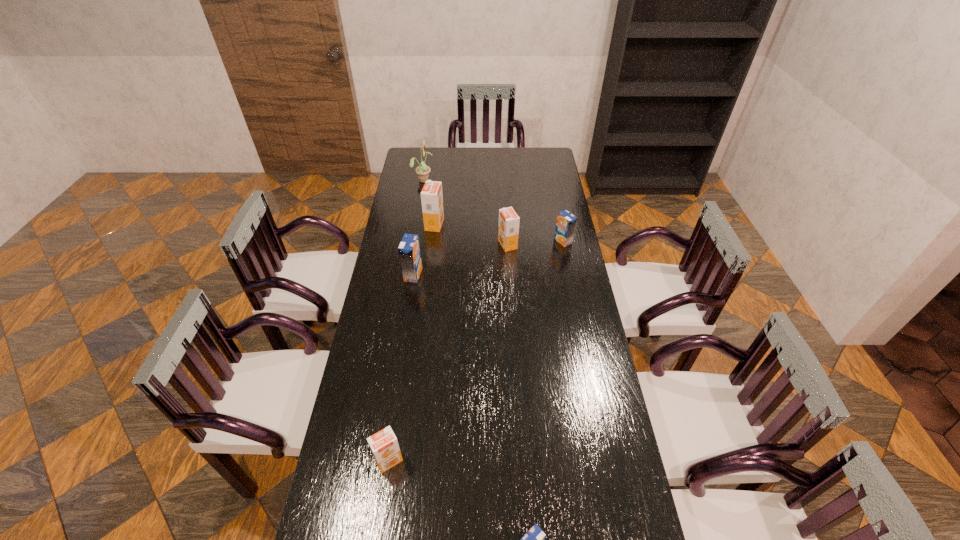
You are a GUI agent. You are given a task and a screenshot of the screen. Output one action in this format:
    pyautogui.click(x=<x>, y=<y>)
    Task: Click on the free spot at the far edge of the desktop
    This screenshot has width=960, height=540.
    Given the screenshot: What is the action you would take?
    [513, 151]

Locate an element on the screen. The width and height of the screenshot is (960, 540). free space at the left edge is located at coordinates (x=401, y=265).

You are a GUI agent. You are given a task and a screenshot of the screen. Output one action in this format:
    pyautogui.click(x=<x>, y=<y>)
    Task: Click on the vacant space at the right edge of the desktop
    
    Given the screenshot: What is the action you would take?
    pyautogui.click(x=580, y=343)

Identify the location of vacant space at the far left corner of the desktop. (412, 157).

The height and width of the screenshot is (540, 960). In the image, there is a desktop. Identify the location of free space at the far right corner. 536,170.

What are the coordinates of `empty space between the second nearest orange_juice and the yellow sunflower` in the screenshot? It's located at point(406,320).

Image resolution: width=960 pixels, height=540 pixels. Identify the location of vacant area that lies between the rightmost orange_juice and the second biggest orange orange juice. (536, 243).

Locate an element on the screen. free spot between the second smallest blue orange_juice and the second biggest orange orange juice is located at coordinates (536, 243).

Find the location of `free space between the sunflower and the second biggest blue orange_juice`. free space between the sunflower and the second biggest blue orange_juice is located at coordinates (493, 211).

Locate which object is the second closest to the biggest orange orange juice. Please provide its 2D coordinates. Your answer should be formatted as a tuple, i.e. [(x, y)], where the tuple contains the x and y coordinates of a point satisfying the conditions above.

[(508, 227)]